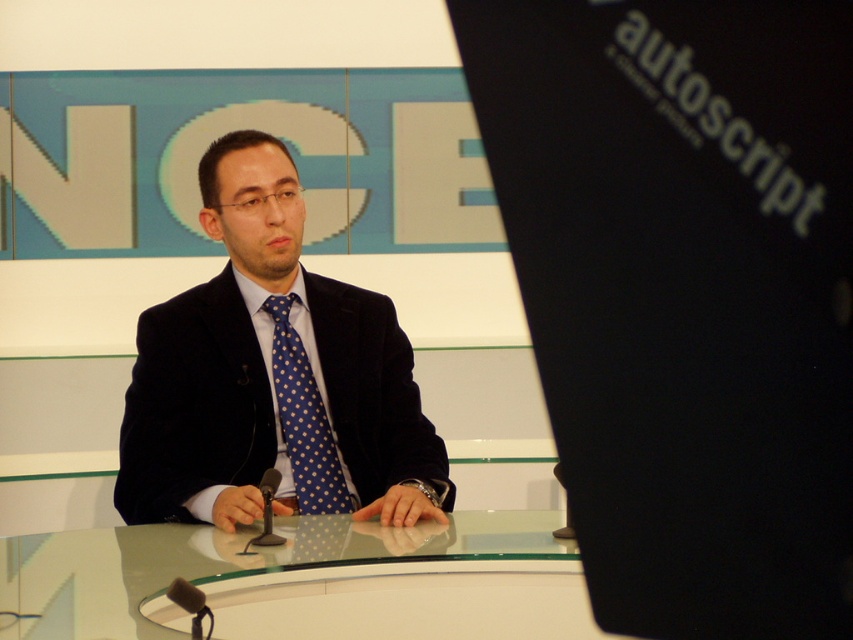
You are designing a virtual set for a news broadcast and need to ensure the satin black suit at center and transparent glass table at center are visible to the audience. Given their sizes, which object might require more careful lighting to avoid overwhelming the other?

The satin black suit at center is larger in size than the transparent glass table at center, so the satin black suit at center might require more careful lighting to avoid overwhelming the smaller table.

You are a costume designer preparing for a TV show. You need to know the correct arrangement of the outfit items shown in the scene. Which item is positioned to the left of the other between the satin black suit at center and the blue dotted fabric tie at center?

The satin black suit at center is positioned to the left of the blue dotted fabric tie at center.

You are a costume designer preparing for a photoshoot. You need to place a white silk scarf on the transparent glass table at center so that it doesn not get covered by the satin black suit at center. Where should you place the scarf?

The satin black suit at center is above the transparent glass table at center, so placing the white silk scarf on the table below the suit would ensure it remains visible and uncovered.